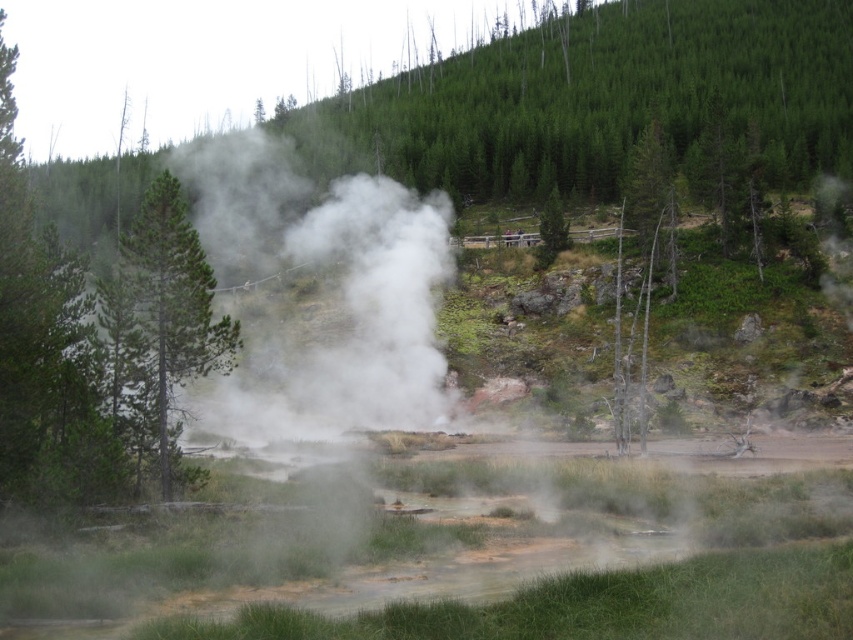
Question: In this image, where is green matte tree at center-left located relative to green matte tree at center?

Choices:
 (A) above
 (B) below

Answer: (B)

Question: Which of the following is the closest to the observer?

Choices:
 (A) green matte tree at center-left
 (B) green matte tree at center

Answer: (A)

Question: Can you confirm if green matte tree at center-left is positioned above green matte tree at center?

Choices:
 (A) yes
 (B) no

Answer: (B)

Question: Which point appears closest to the camera in this image?

Choices:
 (A) (137, 236)
 (B) (553, 243)

Answer: (A)

Question: Among these objects, which one is nearest to the camera?

Choices:
 (A) green matte tree at center-left
 (B) green matte tree at center

Answer: (A)

Question: Is green matte tree at center-left smaller than green matte tree at center?

Choices:
 (A) no
 (B) yes

Answer: (B)